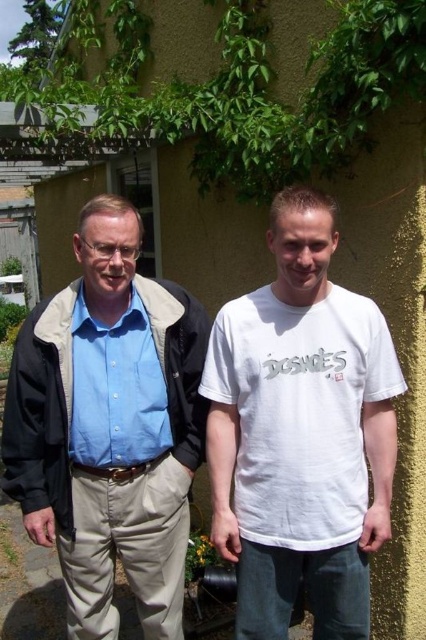
Question: Does white cotton t-shirt at center have a larger size compared to green leafy ivy at upper center?

Choices:
 (A) yes
 (B) no

Answer: (B)

Question: Which object is the farthest from the green leafy ivy at upper center?

Choices:
 (A) matte blue shirt at left
 (B) blue cotton shirt at center
 (C) white cotton t-shirt at center

Answer: (B)

Question: Is white cotton t-shirt at center closer to the viewer compared to matte blue shirt at left?

Choices:
 (A) no
 (B) yes

Answer: (B)

Question: Does white cotton t-shirt at center have a larger size compared to matte blue shirt at left?

Choices:
 (A) yes
 (B) no

Answer: (A)

Question: Which is nearer to the blue cotton shirt at center?

Choices:
 (A) white cotton t-shirt at center
 (B) green leafy ivy at upper center
 (C) matte blue shirt at left

Answer: (C)

Question: Based on their relative distances, which object is nearer to the green leafy ivy at upper center?

Choices:
 (A) matte blue shirt at left
 (B) blue cotton shirt at center
 (C) white cotton t-shirt at center

Answer: (A)